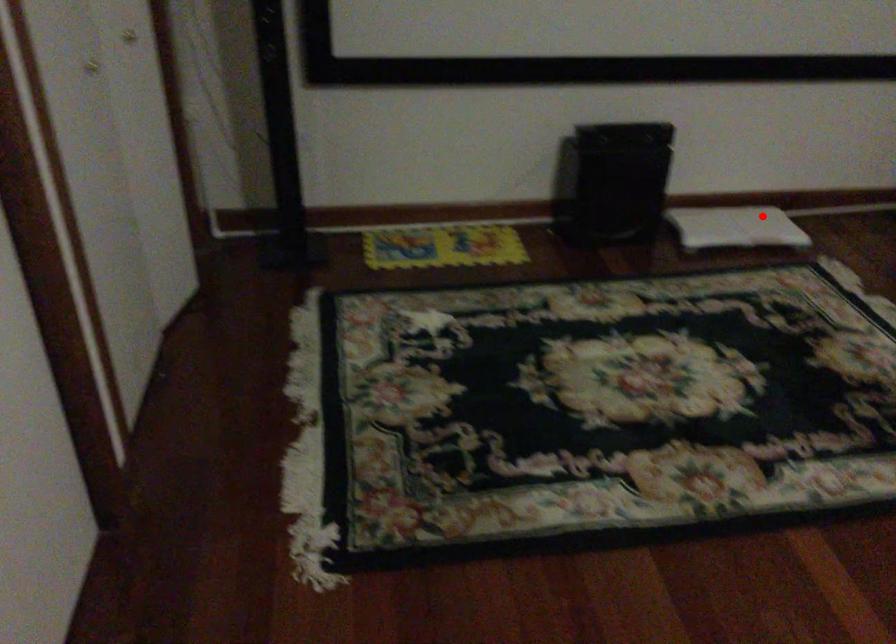
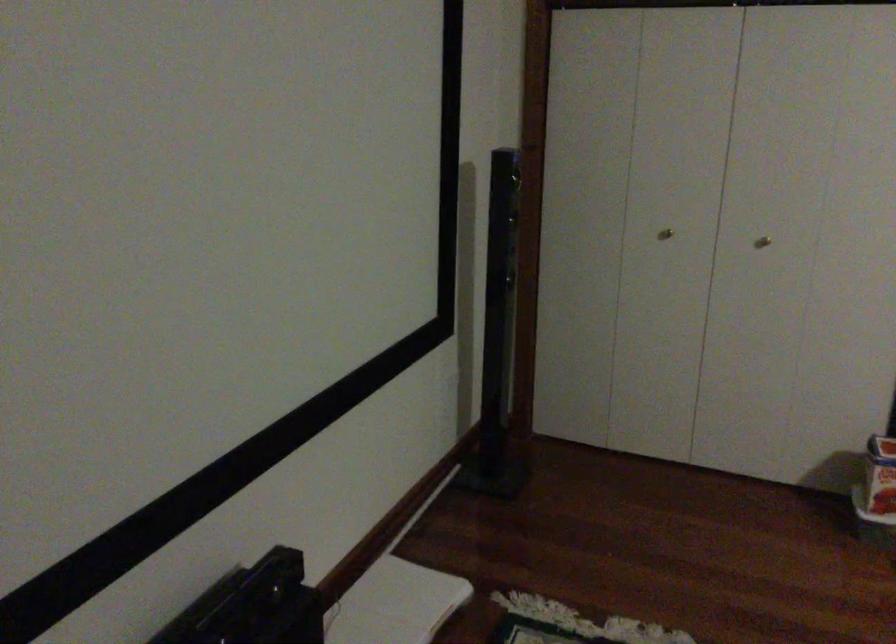
Question: A red point is marked in image1. In image2, is the corresponding 3D point closer to the camera or farther? Reply with the corresponding letter.

Choices:
 (A) The corresponding 3D point is closer.
 (B) The corresponding 3D point is farther.

Answer: (A)